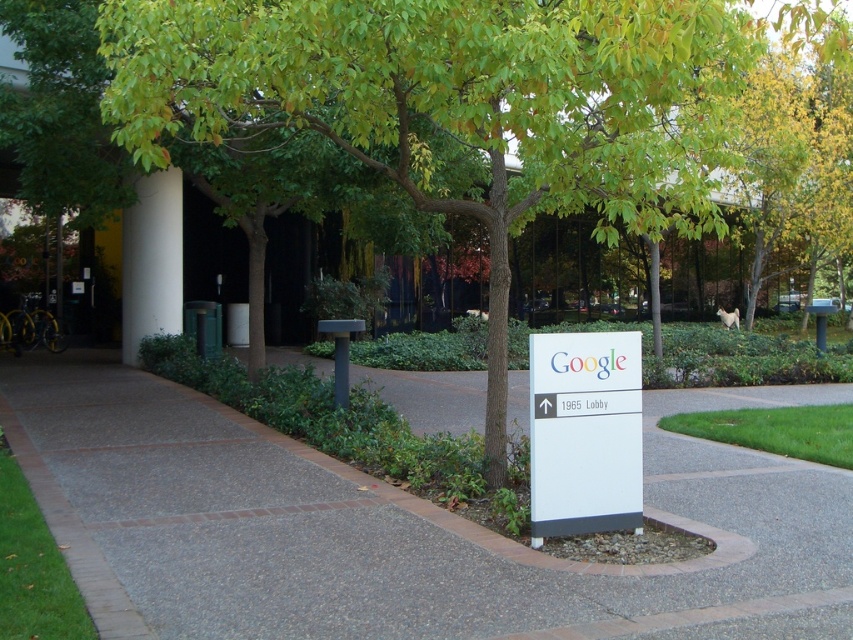
How much distance is there between white plastic sign at center and white smooth pillar at center-left?

A distance of 10.57 meters exists between white plastic sign at center and white smooth pillar at center-left.

Does white plastic sign at center appear over white smooth pillar at center-left?

No, white plastic sign at center is not above white smooth pillar at center-left.

I want to click on white plastic sign at center, so click(584, 433).

Is gray concrete pavement at center shorter than white plastic sign at center?

Yes.

Does gray concrete pavement at center have a lesser width compared to white plastic sign at center?

In fact, gray concrete pavement at center might be wider than white plastic sign at center.

The height and width of the screenshot is (640, 853). Find the location of `gray concrete pavement at center`. gray concrete pavement at center is located at coordinates (399, 528).

Is gray concrete pavement at center thinner than white smooth pillar at center-left?

In fact, gray concrete pavement at center might be wider than white smooth pillar at center-left.

Does gray concrete pavement at center have a greater height compared to white smooth pillar at center-left?

In fact, gray concrete pavement at center may be shorter than white smooth pillar at center-left.

Who is more forward, (x=155, y=444) or (x=167, y=316)?

A: Point (x=155, y=444)

Image resolution: width=853 pixels, height=640 pixels. In order to click on gray concrete pavement at center in this screenshot , I will do `click(399, 528)`.